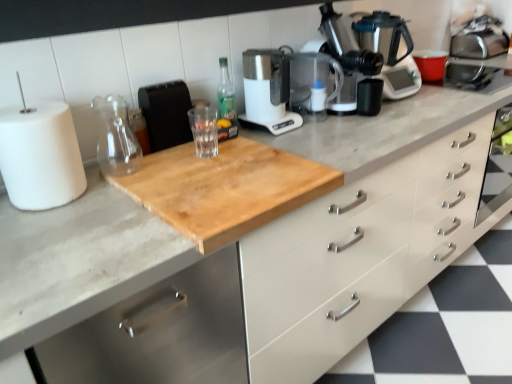
I want to click on free point above natural wood cutting board at center (from a real-world perspective), so click(87, 222).